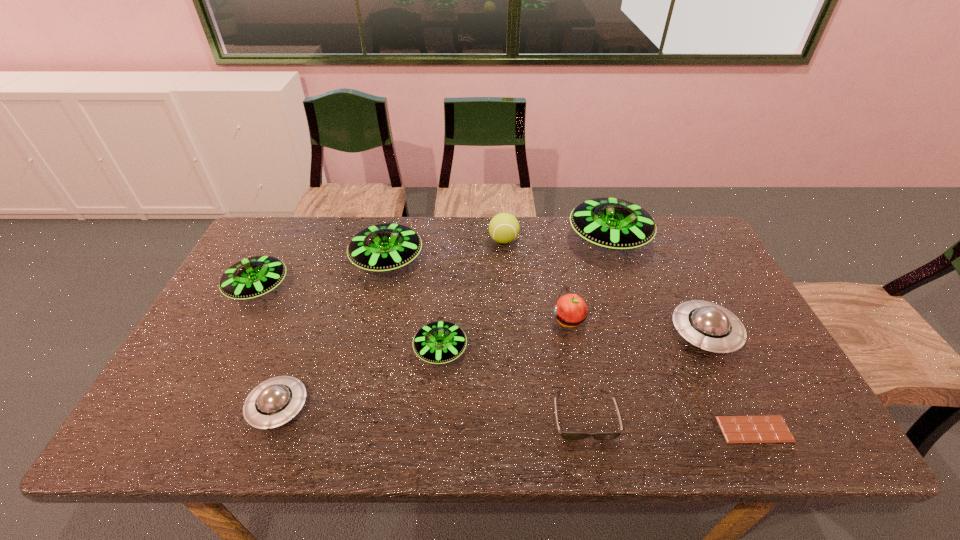
At what (x,y) coordinates should I click in order to perform the action: click on vacant area located on the left of the apple. Please return your answer as a coordinate pair (x, y). Image resolution: width=960 pixels, height=540 pixels. Looking at the image, I should click on (512, 320).

Where is `vacant space situated 0.260m on the front of the green tennis ball`? This screenshot has width=960, height=540. vacant space situated 0.260m on the front of the green tennis ball is located at coordinates (508, 309).

Where is `blank area located on the front of the second smallest green saucer`? The image size is (960, 540). blank area located on the front of the second smallest green saucer is located at coordinates pyautogui.click(x=221, y=361).

Find the location of a particular element. The image size is (960, 540). vacant region located on the left of the right gray saucer is located at coordinates (535, 333).

Image resolution: width=960 pixels, height=540 pixels. Identify the location of blank space located 0.190m on the right of the third green saucer from left to right. (541, 350).

Locate an element on the screen. This screenshot has width=960, height=540. vacant region located on the left of the nearest saucer is located at coordinates (x=201, y=407).

In order to click on vacant space positioned 0.210m on the left of the chocolate bar in this screenshot , I will do `click(625, 429)`.

Locate an element on the screen. The image size is (960, 540). tennis ball that is at the far edge is located at coordinates (504, 228).

Identify the location of saucer at the near edge. The image size is (960, 540). (274, 402).

Locate an element on the screen. sunglasses positioned at the near edge is located at coordinates (565, 435).